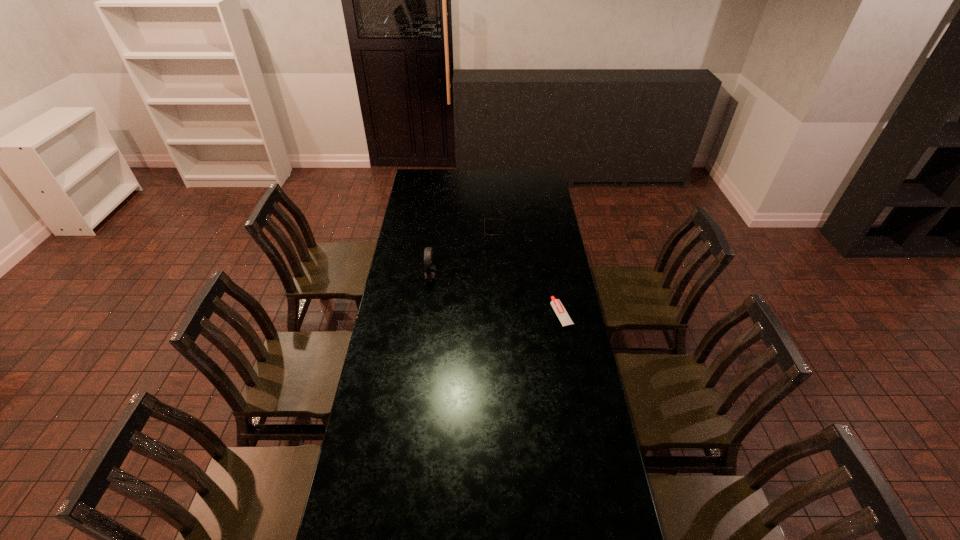
Identify the location of vacant region that satisfies the following two spatial constraints: 1. on the front-facing side of the toothpaste; 2. on the right side of the leftmost object. (426, 314).

Locate an element on the screen. Image resolution: width=960 pixels, height=540 pixels. free space in the image that satisfies the following two spatial constraints: 1. on the front-facing side of the nearest object; 2. on the right side of the sunglasses is located at coordinates (498, 314).

Where is `vacant region that satisfies the following two spatial constraints: 1. on the front-facing side of the tallest object; 2. on the back side of the nearest object`? The height and width of the screenshot is (540, 960). vacant region that satisfies the following two spatial constraints: 1. on the front-facing side of the tallest object; 2. on the back side of the nearest object is located at coordinates (426, 314).

I want to click on free point that satisfies the following two spatial constraints: 1. on the front-facing side of the farthest object; 2. on the right side of the nearest object, so click(x=498, y=314).